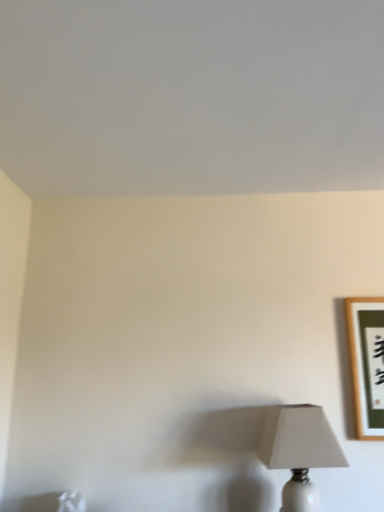
What do you see at coordinates (367, 362) in the screenshot? Image resolution: width=384 pixels, height=512 pixels. I see `wooden framed artwork at upper right` at bounding box center [367, 362].

At what (x,y) coordinates should I click in order to perform the action: click on wooden framed artwork at upper right. Please return your answer as a coordinate pair (x, y). Looking at the image, I should click on (367, 362).

Measure the distance between point (x=311, y=405) and camera.

1.60 meters.

What do you see at coordinates (299, 451) in the screenshot? The image size is (384, 512). I see `white ceramic lamp at lower right` at bounding box center [299, 451].

At what (x,y) coordinates should I click in order to perform the action: click on white ceramic lamp at lower right. Please return your answer as a coordinate pair (x, y). Looking at the image, I should click on (299, 451).

Where is `wooden framed artwork at upper right`? This screenshot has width=384, height=512. wooden framed artwork at upper right is located at coordinates (367, 362).

Considering the relative positions of wooden framed artwork at upper right and white ceramic lamp at lower right in the image provided, is wooden framed artwork at upper right to the right of white ceramic lamp at lower right from the viewer's perspective?

Yes.

Based on the photo, who is more distant, wooden framed artwork at upper right or white ceramic lamp at lower right?

wooden framed artwork at upper right.

Does point (378, 332) come in front of point (302, 425)?

No, (378, 332) is further to viewer.

From the image's perspective, is wooden framed artwork at upper right beneath white ceramic lamp at lower right?

No, from the image's perspective, wooden framed artwork at upper right is not below white ceramic lamp at lower right.

From a real-world perspective, who is located lower, wooden framed artwork at upper right or white ceramic lamp at lower right?

In real-world perspective, white ceramic lamp at lower right is lower.

Considering the sizes of objects wooden framed artwork at upper right and white ceramic lamp at lower right in the image provided, who is thinner, wooden framed artwork at upper right or white ceramic lamp at lower right?

wooden framed artwork at upper right is thinner.

Is wooden framed artwork at upper right taller or shorter than white ceramic lamp at lower right?

In the image, wooden framed artwork at upper right appears to be taller than white ceramic lamp at lower right.

Between wooden framed artwork at upper right and white ceramic lamp at lower right, which one has smaller size?

wooden framed artwork at upper right is smaller.

Is wooden framed artwork at upper right inside the boundaries of white ceramic lamp at lower right, or outside?

wooden framed artwork at upper right is located beyond the bounds of white ceramic lamp at lower right.

From the picture: Is wooden framed artwork at upper right next to white ceramic lamp at lower right and touching it?

No, wooden framed artwork at upper right is not in contact with white ceramic lamp at lower right.

Is wooden framed artwork at upper right aimed at white ceramic lamp at lower right?

No, wooden framed artwork at upper right is not oriented towards white ceramic lamp at lower right.

What's the angular difference between wooden framed artwork at upper right and white ceramic lamp at lower right's facing directions?

They differ by 3.81 degrees in their facing directions.

Measure the distance from wooden framed artwork at upper right to white ceramic lamp at lower right.

They are 12.08 inches apart.

Locate an element on the screen. The image size is (384, 512). picture frame on the right of white ceramic lamp at lower right is located at coordinates (367, 362).

Which object is positioned more to the left, white ceramic lamp at lower right or wooden framed artwork at upper right?

From the viewer's perspective, white ceramic lamp at lower right appears more on the left side.

Is white ceramic lamp at lower right positioned before wooden framed artwork at upper right?

That is True.

Which point is more forward, [317,445] or [373,392]?

Point [317,445]

From the image's perspective, is white ceramic lamp at lower right on top of wooden framed artwork at upper right?

No.

From a real-world perspective, is white ceramic lamp at lower right above or below wooden framed artwork at upper right?

From a real-world perspective, white ceramic lamp at lower right is physically below wooden framed artwork at upper right.

Which object is wider, white ceramic lamp at lower right or wooden framed artwork at upper right?

white ceramic lamp at lower right.

Is white ceramic lamp at lower right taller than wooden framed artwork at upper right?

No, white ceramic lamp at lower right is not taller than wooden framed artwork at upper right.

Considering the relative sizes of white ceramic lamp at lower right and wooden framed artwork at upper right in the image provided, is white ceramic lamp at lower right smaller than wooden framed artwork at upper right?

Actually, white ceramic lamp at lower right might be larger than wooden framed artwork at upper right.

Do you think white ceramic lamp at lower right is within wooden framed artwork at upper right, or outside of it?

The correct answer is: outside.

Is white ceramic lamp at lower right in contact with wooden framed artwork at upper right?

No, white ceramic lamp at lower right is not with wooden framed artwork at upper right.

Is white ceramic lamp at lower right facing towards wooden framed artwork at upper right?

No, white ceramic lamp at lower right is not aimed at wooden framed artwork at upper right.

The height and width of the screenshot is (512, 384). Find the location of `lamp located underneath the wooden framed artwork at upper right (from a real-world perspective)`. lamp located underneath the wooden framed artwork at upper right (from a real-world perspective) is located at coordinates (299, 451).

The height and width of the screenshot is (512, 384). In order to click on lamp on the left of wooden framed artwork at upper right in this screenshot , I will do pyautogui.click(x=299, y=451).

Where is `picture frame behind the white ceramic lamp at lower right`? Image resolution: width=384 pixels, height=512 pixels. picture frame behind the white ceramic lamp at lower right is located at coordinates (367, 362).